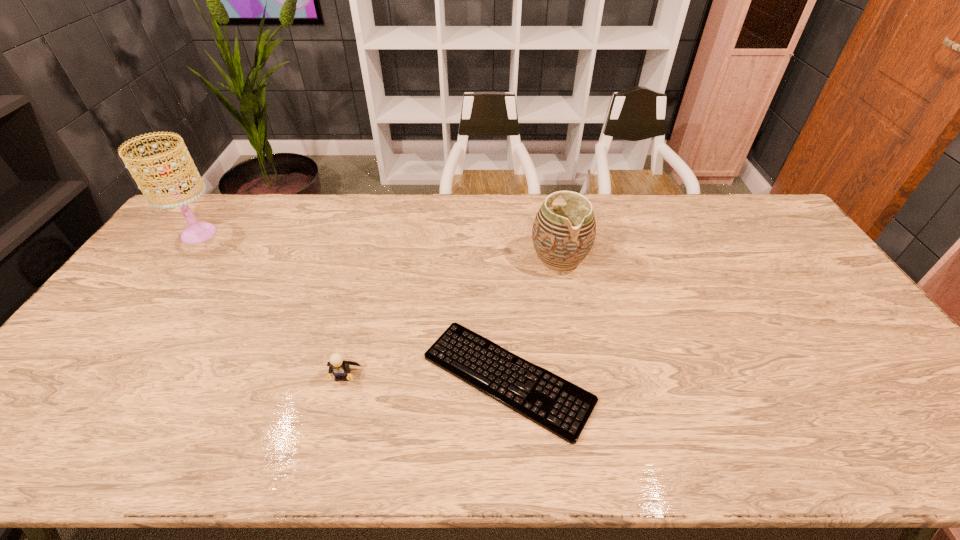
I want to click on unoccupied position between the tallest object and the third object from right to left, so click(271, 305).

The image size is (960, 540). I want to click on blank region between the computer keyboard and the Lego, so click(x=425, y=377).

Find the location of a particular element. Image resolution: width=960 pixels, height=540 pixels. vacant space in between the lampshade and the pottery is located at coordinates (379, 246).

Find the location of a particular element. empty location between the third shortest object and the Lego is located at coordinates (451, 317).

At what (x,y) coordinates should I click in order to perform the action: click on free spot between the shortest object and the second shortest object. Please return your answer as a coordinate pair (x, y). Looking at the image, I should click on (425, 377).

Identify the location of vacant area between the Lego and the shortest object. (425, 377).

The width and height of the screenshot is (960, 540). I want to click on free space that is in between the leftmost object and the computer keyboard, so click(x=353, y=306).

I want to click on empty space between the second tallest object and the computer keyboard, so click(x=534, y=318).

In order to click on free space between the computer keyboard and the third shortest object in this screenshot , I will do `click(534, 318)`.

The height and width of the screenshot is (540, 960). I want to click on object that is the closest to the computer keyboard, so click(x=338, y=367).